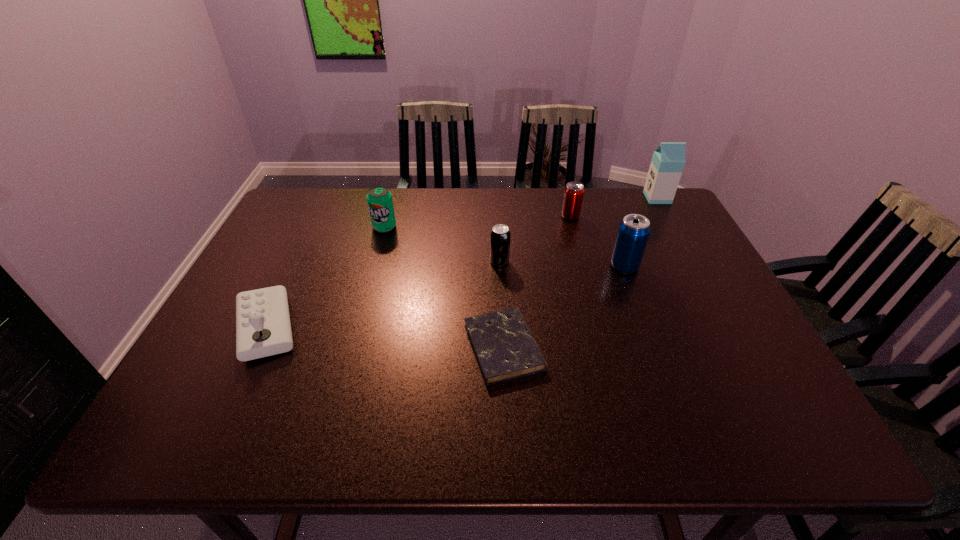
Where is `vacant space at the far edge of the desktop`? This screenshot has height=540, width=960. vacant space at the far edge of the desktop is located at coordinates 536,190.

Identify the location of free space at the near edge of the desktop. (540, 434).

Locate an element on the screen. vacant space at the left edge of the desktop is located at coordinates (280, 260).

Where is `free spot at the right edge of the desktop`? free spot at the right edge of the desktop is located at coordinates (684, 243).

You are a GUI agent. You are given a task and a screenshot of the screen. Output one action in this format:
    pyautogui.click(x=<x>, y=<y>)
    Task: Click on the vacant space at the far left corner of the desktop
    
    Given the screenshot: What is the action you would take?
    pyautogui.click(x=315, y=197)

Locate an element on the screen. blank space at the near left corner is located at coordinates (224, 432).

Where is `vacant space at the far right corner`? The height and width of the screenshot is (540, 960). vacant space at the far right corner is located at coordinates [667, 227].

Identify the location of free space at the near right corner of the desktop. Image resolution: width=960 pixels, height=540 pixels. (776, 431).

I want to click on free space between the third soda can from right to left and the rightmost soda can, so click(x=562, y=264).

Locate an element on the screen. empty location between the shortest object and the third soda can from right to left is located at coordinates (502, 305).